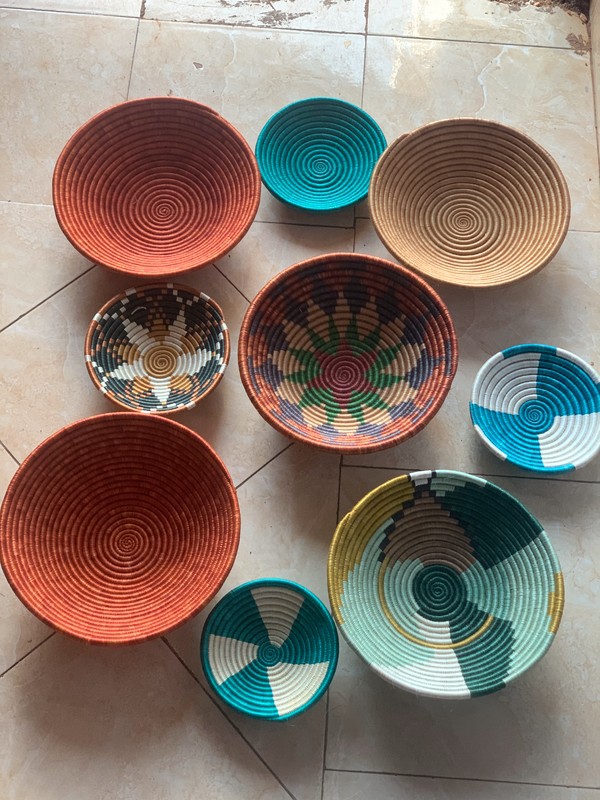
Image resolution: width=600 pixels, height=800 pixels. I want to click on bowls, so click(114, 533), click(297, 641), click(434, 586), click(544, 393), click(402, 393), click(182, 357), click(182, 238), click(345, 174), click(440, 246), click(132, 225).